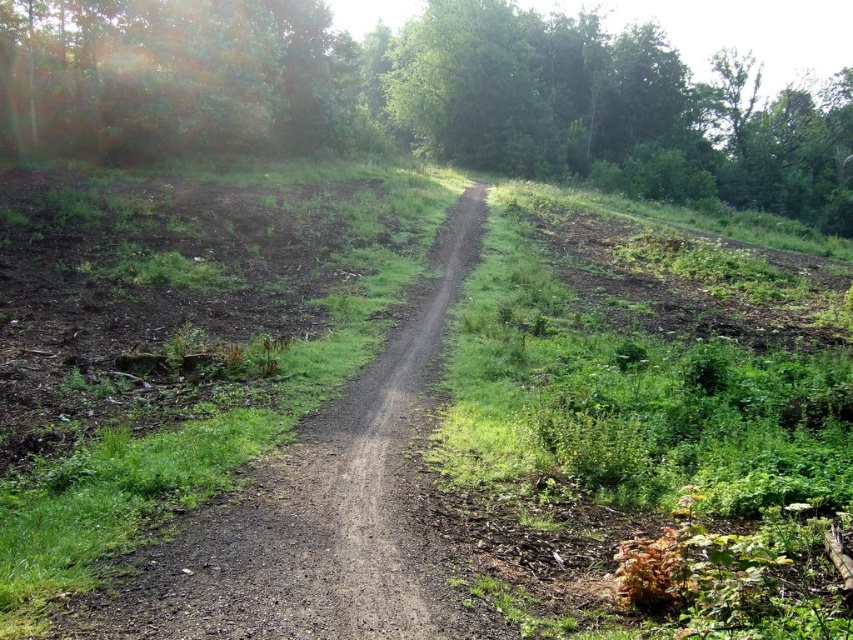
Question: Which point is farther to the camera?

Choices:
 (A) (370, 401)
 (B) (836, 150)

Answer: (B)

Question: Which point is closer to the camera?

Choices:
 (A) dirt/gravel trail at center
 (B) green leafy tree at center

Answer: (A)

Question: Which object is farther from the camera taking this photo?

Choices:
 (A) dirt/gravel trail at center
 (B) green leafy tree at center

Answer: (B)

Question: Can you confirm if green leafy tree at center is thinner than dirt/gravel trail at center?

Choices:
 (A) no
 (B) yes

Answer: (A)

Question: Is green leafy tree at center positioned behind dirt/gravel trail at center?

Choices:
 (A) yes
 (B) no

Answer: (A)

Question: Does green leafy tree at center have a smaller size compared to dirt/gravel trail at center?

Choices:
 (A) no
 (B) yes

Answer: (A)